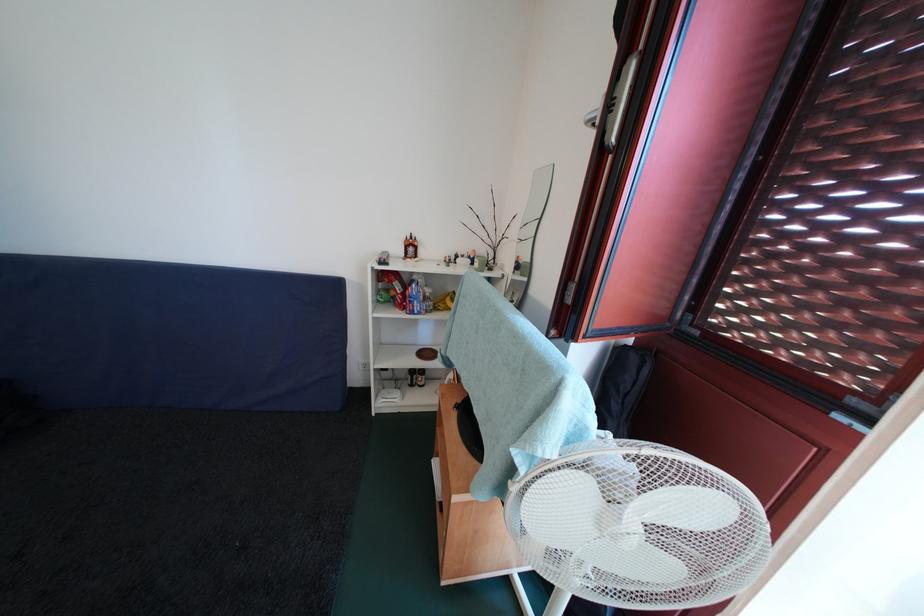
You are a GUI agent. You are given a task and a screenshot of the screen. Output one action in this format:
    pyautogui.click(x=<x>, y=<y>)
    Task: Click on the silver window handle
    The width and height of the screenshot is (924, 616).
    Given the screenshot: What is the action you would take?
    pyautogui.click(x=614, y=107)